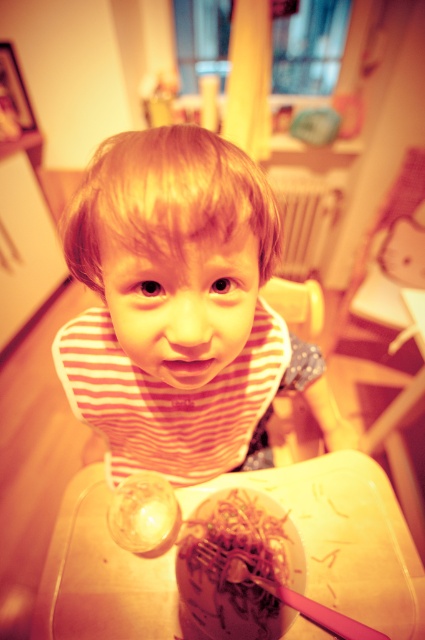
Question: Is striped fabric bib at center below pink plastic chopstick at lower center?

Choices:
 (A) yes
 (B) no

Answer: (B)

Question: Which point is closer to the camera?

Choices:
 (A) (189, 508)
 (B) (204, 600)
 (C) (283, 593)

Answer: (C)

Question: Is the position of shiny brown noodles at lower center less distant than that of pink plastic chopstick at lower center?

Choices:
 (A) no
 (B) yes

Answer: (A)

Question: Based on their relative distances, which object is nearer to the striped fabric bib at center?

Choices:
 (A) translucent plastic tray at center
 (B) shiny brown noodles at lower center
 (C) pink plastic chopstick at lower center

Answer: (B)

Question: Is striped fabric bib at center closer to the viewer compared to pink plastic chopstick at lower center?

Choices:
 (A) no
 (B) yes

Answer: (B)

Question: Which point is farther from the camera taking this photo?

Choices:
 (A) (285, 518)
 (B) (186, 452)
 (C) (99, 483)

Answer: (C)